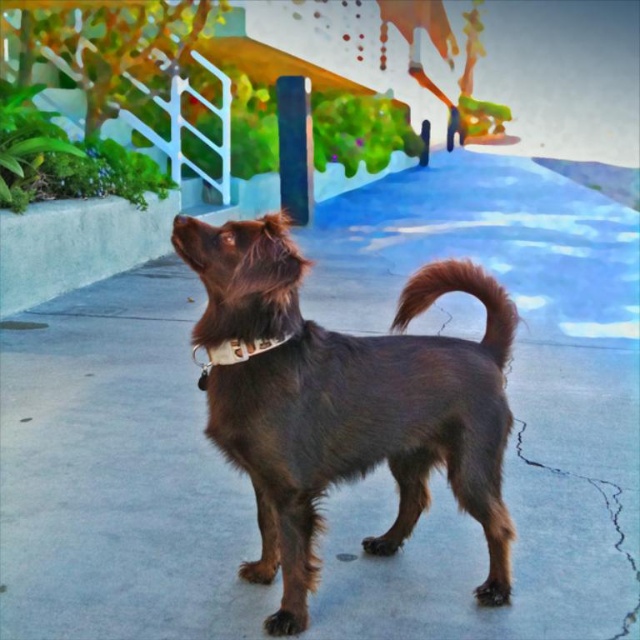
Question: Which object is farther from the camera taking this photo?

Choices:
 (A) white fabric neckband at center
 (B) brown fur nose at center

Answer: (A)

Question: Which point is farther from the camera taking this photo?

Choices:
 (A) (508, 314)
 (B) (468, 268)

Answer: (A)

Question: Is brown furry tail at center closer to camera compared to white fabric neckband at center?

Choices:
 (A) yes
 (B) no

Answer: (B)

Question: Does brown furry dog at center come in front of white fabric neckband at center?

Choices:
 (A) no
 (B) yes

Answer: (B)

Question: Considering the real-world distances, which object is closest to the brown fur nose at center?

Choices:
 (A) brown furry dog at center
 (B) brown furry tail at center

Answer: (A)

Question: Does brown furry dog at center have a smaller size compared to brown furry tail at center?

Choices:
 (A) no
 (B) yes

Answer: (A)